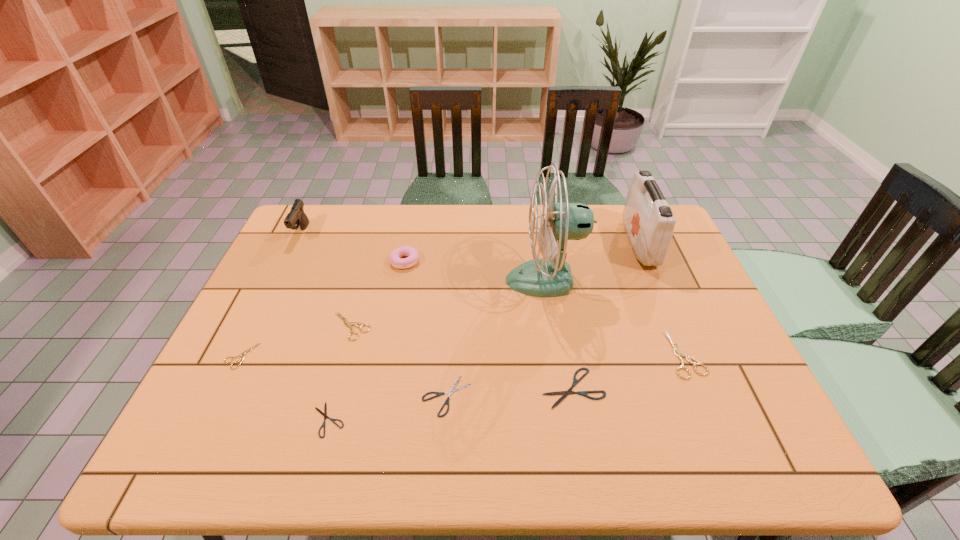
At what (x,y) coordinates should I click in order to perform the action: click on fan. Please return your answer as a coordinate pair (x, y). This screenshot has height=540, width=960. Looking at the image, I should click on click(x=550, y=276).

This screenshot has width=960, height=540. Identify the location of the tallest object. (550, 276).

The image size is (960, 540). I want to click on red first-aid kit, so click(648, 220).

I want to click on the first-aid kit, so click(648, 220).

In order to click on pistol in this screenshot , I will do `click(296, 217)`.

Identify the location of the eighth shortest object. Image resolution: width=960 pixels, height=540 pixels. (296, 217).

Where is `the sixth object from right to left`? The image size is (960, 540). the sixth object from right to left is located at coordinates (395, 256).

The image size is (960, 540). I want to click on the fourth tallest object, so click(395, 256).

Where is `the rightmost shears`? The height and width of the screenshot is (540, 960). the rightmost shears is located at coordinates (679, 354).

Image resolution: width=960 pixels, height=540 pixels. In order to click on the biggest beige shears in this screenshot , I will do `click(679, 354)`.